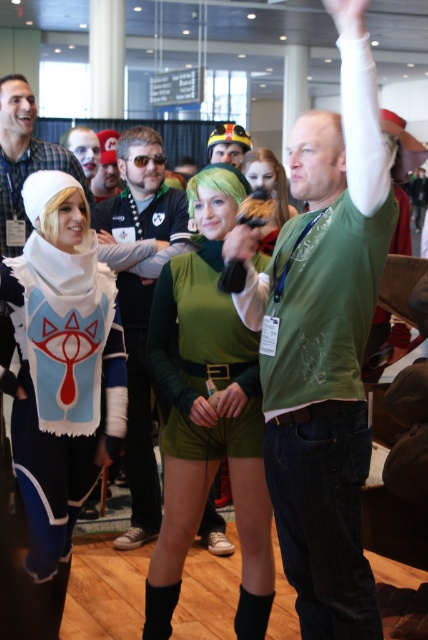
You are a photographer at this event and need to capture a photo that includes both the white plush cape at left and the matte black mask at center. Since you want to ensure both are visible in the frame, which object should you focus on first to account for their size difference?

The white plush cape at left is much taller than the matte black mask at center, so you should focus on the white plush cape at left first to ensure its full height is captured in the frame.

Consider the image. You are a photographer at the event and need to position yourself to capture both the green corduroy shirt at center and the matte black mask at center in a single frame. Which object should you focus on first if you want to ensure both are in the shot?

The green corduroy shirt at center is to the right of the matte black mask at center. To capture both in a single frame, focus on the matte black mask at center first as it is on the left side, then adjust to include the green corduroy shirt at center on the right.